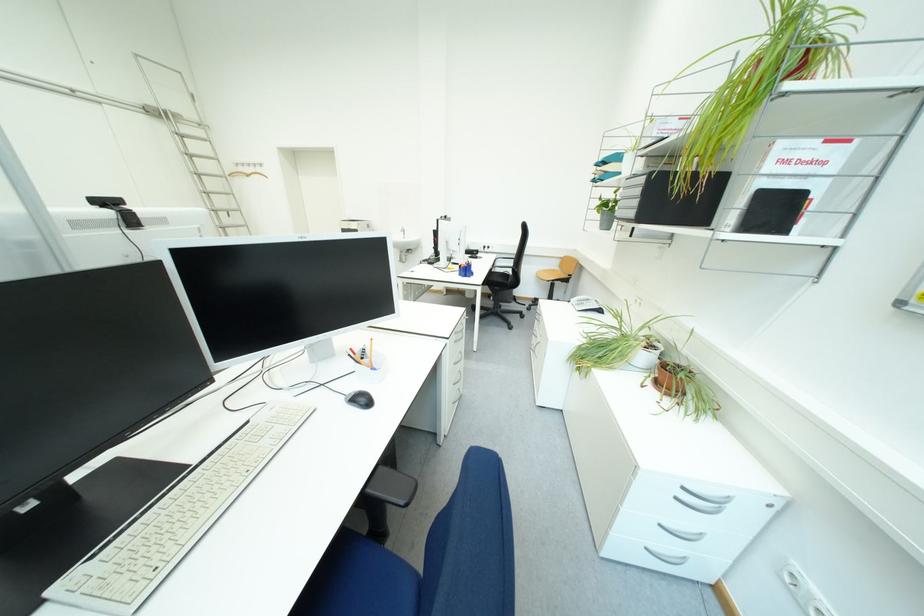
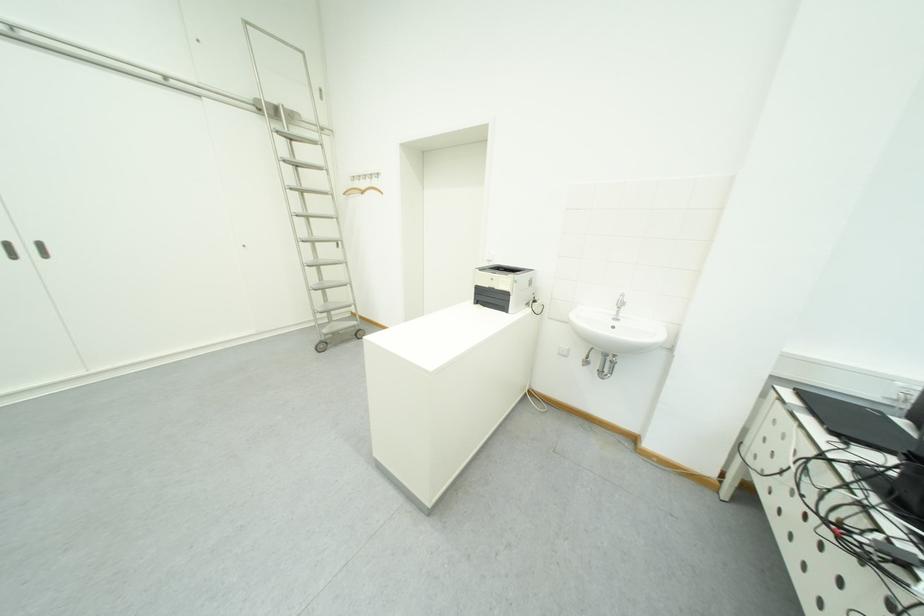
In a continuous first-person perspective shot, in which direction is the camera moving?

The movement direction of the cameraman is left, forward.